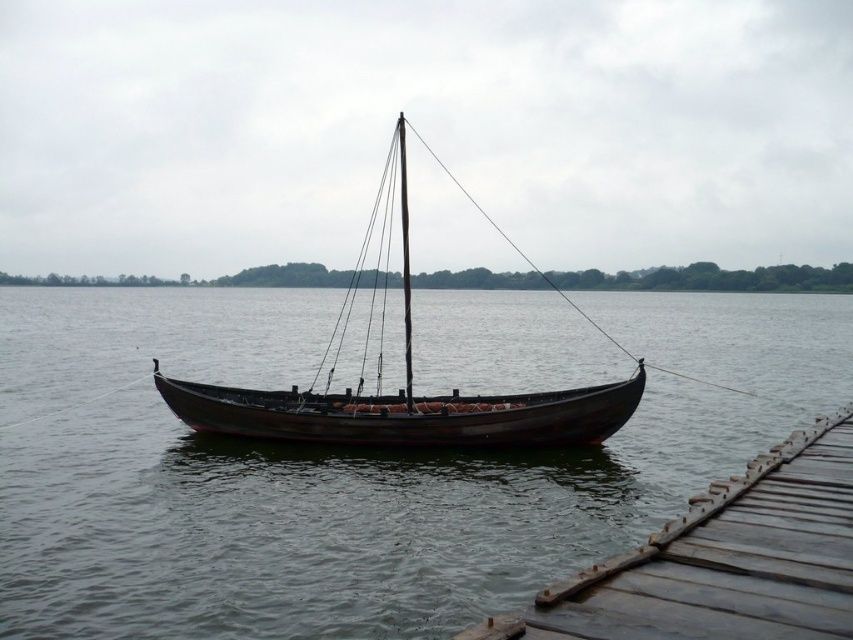
Question: Which of the following is the farthest from the observer?

Choices:
 (A) (379, 410)
 (B) (165, 387)

Answer: (B)

Question: Is brown wooden water at center smaller than wooden canoe at center?

Choices:
 (A) no
 (B) yes

Answer: (A)

Question: Is brown wooden water at center behind rustic wood sailboat at center?

Choices:
 (A) yes
 (B) no

Answer: (B)

Question: Can you confirm if brown wooden water at center is thinner than wooden planks at lower right?

Choices:
 (A) no
 (B) yes

Answer: (A)

Question: Estimate the real-world distances between objects in this image. Which object is farther from the wooden canoe at center?

Choices:
 (A) wooden planks at lower right
 (B) brown wooden water at center
 (C) rustic wood sailboat at center

Answer: (B)

Question: Among these objects, which one is nearest to the camera?

Choices:
 (A) wooden planks at lower right
 (B) brown wooden water at center
 (C) rustic wood sailboat at center
 (D) wooden canoe at center

Answer: (A)